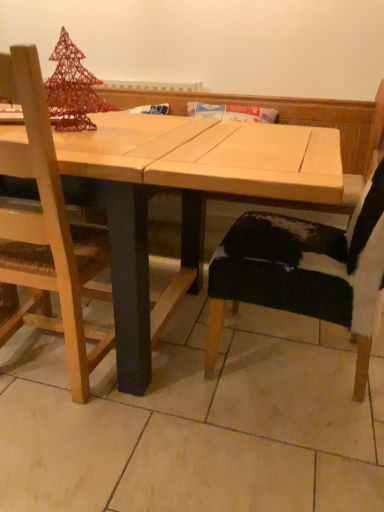
Identify the location of vacant area that lies to the right of wooden chair at left, marked as the 1th chair in a left-to-right arrangement. Image resolution: width=384 pixels, height=512 pixels. (169, 379).